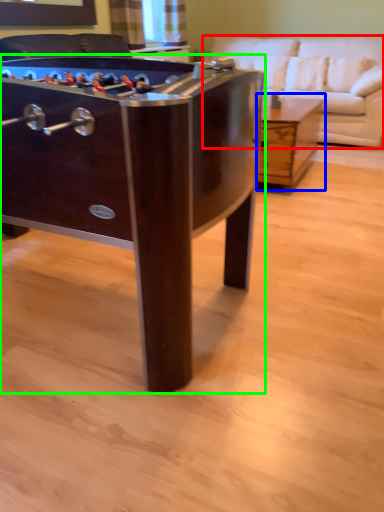
Question: Which is nearer to the studio couch (highlighted by a red box)? table (highlighted by a blue box) or table (highlighted by a green box).

Choices:
 (A) table
 (B) table

Answer: (A)